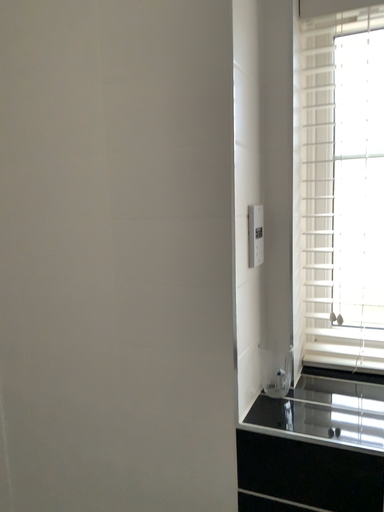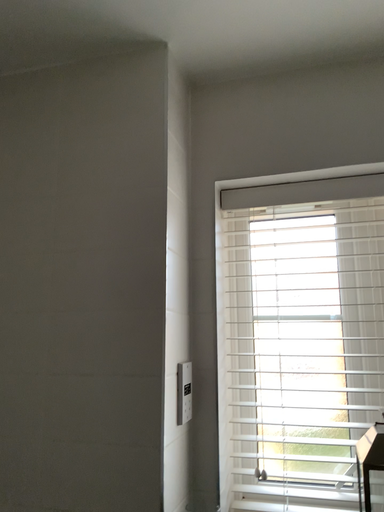
Question: How did the camera likely rotate when shooting the video?

Choices:
 (A) rotated upward
 (B) rotated downward

Answer: (A)